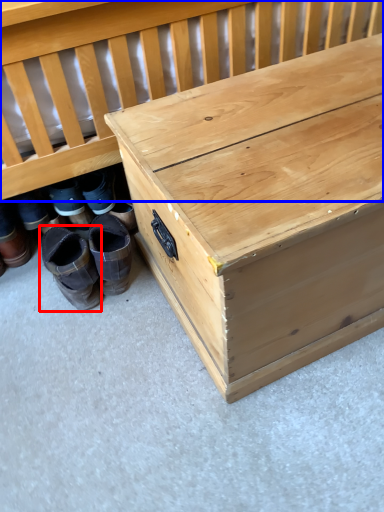
Question: Which of the following is the farthest to the observer, footwear (highlighted by a red box) or infant bed (highlighted by a blue box)?

Choices:
 (A) footwear
 (B) infant bed

Answer: (A)